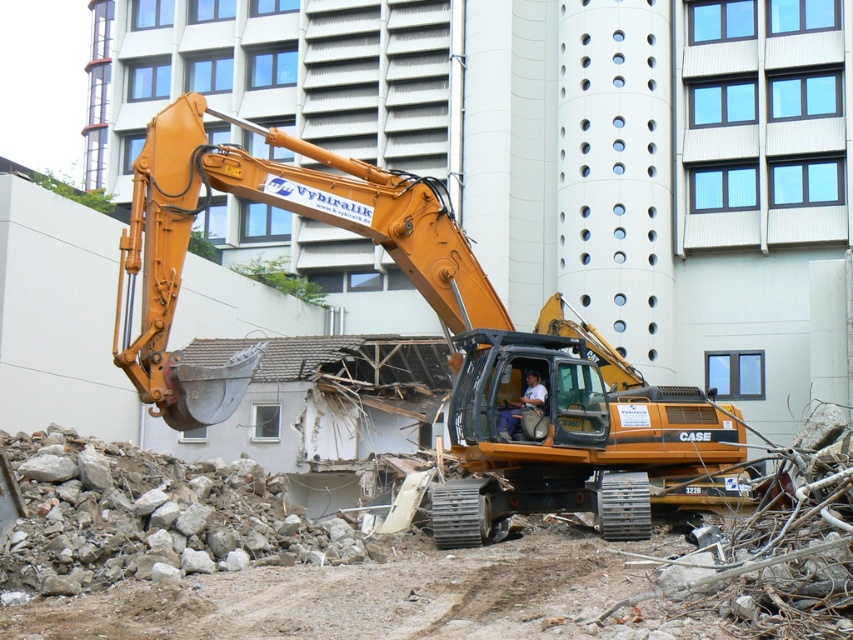
You are standing at the point marked as point (376,220) on a construction site. The excavator is 18.80 meters away from you. Can you safely walk towards the excavator without crossing any dangerous areas?

The point (376,220) is 18.80 meters from the viewer, so yes, you can safely walk towards the excavator as long as you avoid any dangerous areas like the active excavation zone or unstable structures.

You are a safety inspector at the construction site. You notice the orange metallic excavator at center and the light brown leather jacket at center. Which object should you prioritize inspecting for safety compliance?

The orange metallic excavator at center is bigger than the light brown leather jacket at center, so you should prioritize inspecting the orange metallic excavator at center for safety compliance because larger equipment typically requires more rigorous safety checks.

You are a construction worker standing at the point with coordinates point (444, 336). You need to move to the orange metallic excavator at center. Is the excavator directly in front of you?

The point (444, 336) is on orange metallic excavator at center, so you are already on the excavator.